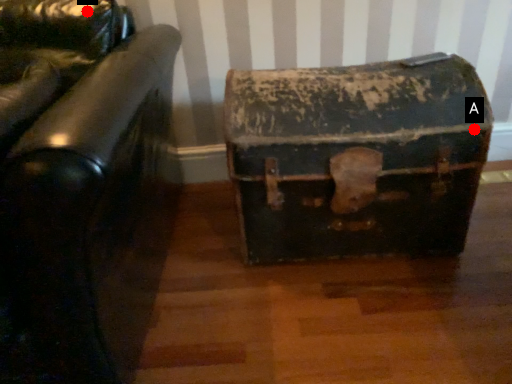
Question: Two points are circled on the image, labeled by A and B beside each circle. Among these points, which one is farthest from the camera?

Choices:
 (A) A is further
 (B) B is further

Answer: (B)